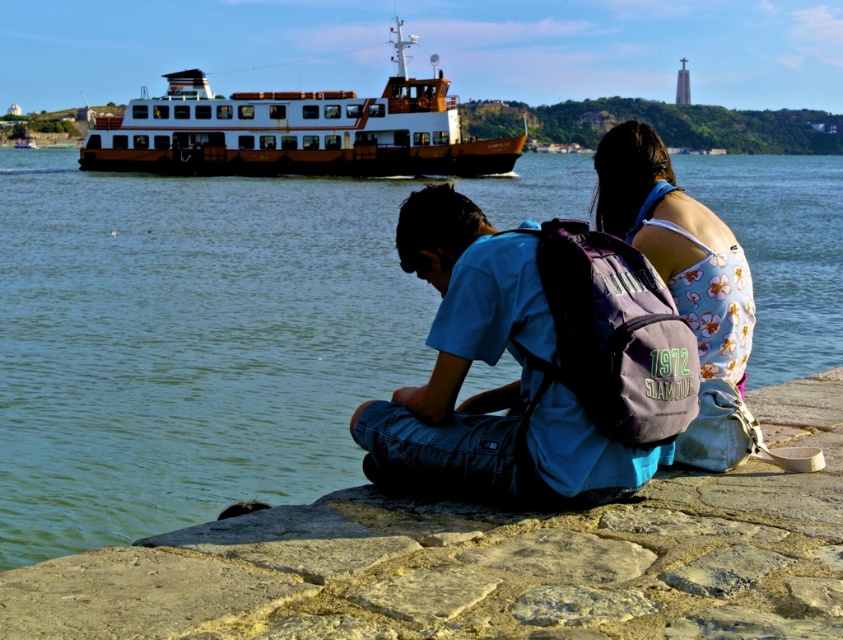
Who is more distant from viewer, (250, 211) or (489, 346)?

The point (250, 211) is behind.

Is green water at lower left positioned behind blue cotton shirt at center?

No.

I want to click on green water at lower left, so click(x=186, y=344).

Is green water at lower left to the left of brown wooden ferry at upper left from the viewer's perspective?

Incorrect, green water at lower left is not on the left side of brown wooden ferry at upper left.

Is green water at lower left thinner than brown wooden ferry at upper left?

In fact, green water at lower left might be wider than brown wooden ferry at upper left.

This screenshot has height=640, width=843. What do you see at coordinates (186, 344) in the screenshot? I see `green water at lower left` at bounding box center [186, 344].

You are a GUI agent. You are given a task and a screenshot of the screen. Output one action in this format:
    pyautogui.click(x=<x>, y=<y>)
    Task: Click on the green water at lower left
    
    Given the screenshot: What is the action you would take?
    pyautogui.click(x=186, y=344)

Which is in front, point (67, 516) or point (675, 240)?

Point (675, 240) is in front.

Can you confirm if green water at lower left is wider than floral fabric tank top at center?

Indeed, green water at lower left has a greater width compared to floral fabric tank top at center.

Find the location of a particular element. green water at lower left is located at coordinates (186, 344).

At what (x,y) coordinates should I click in order to perform the action: click on green water at lower left. Please return your answer as a coordinate pair (x, y). This screenshot has width=843, height=640. Looking at the image, I should click on (186, 344).